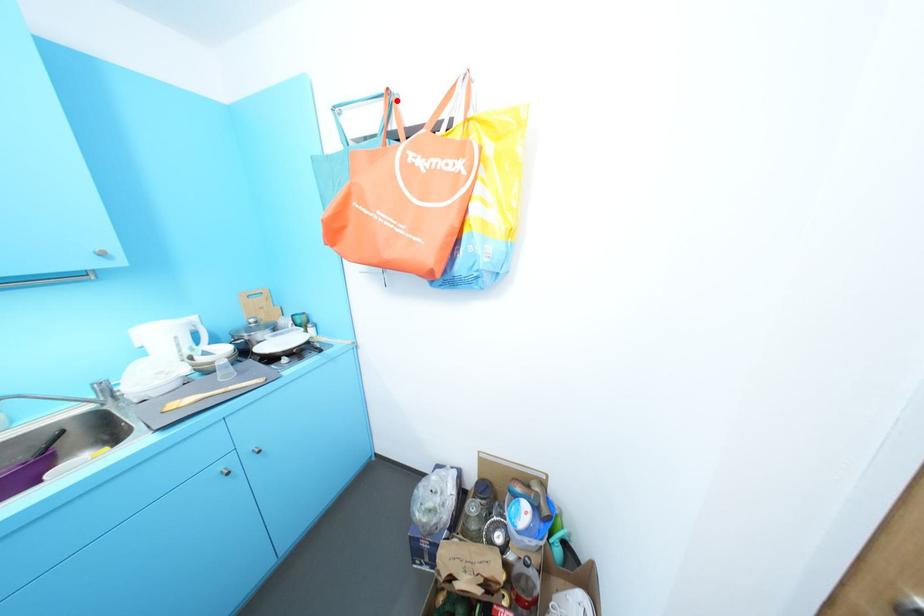
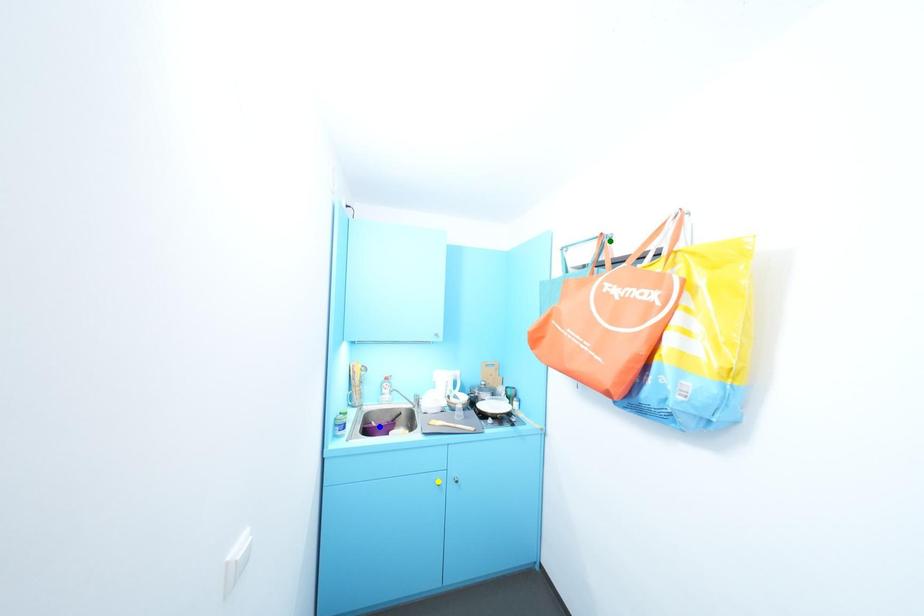
Question: I am providing you with two images of the same scene from different viewpoints. A red point is marked on the first image. You are given multiple points on the second image. Which point in image 2 represents the same 3d spot as the red point in image 1?

Choices:
 (A) green point
 (B) yellow point
 (C) blue point

Answer: (A)